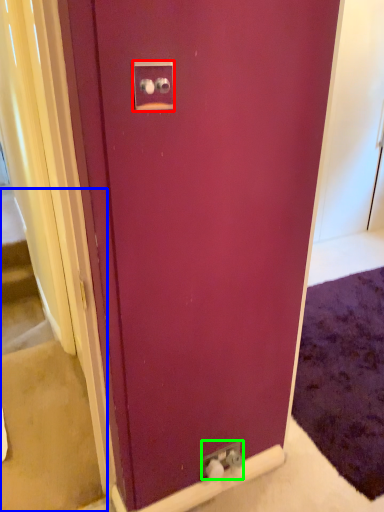
Question: Which object is the closest to the electric outlet (highlighted by a red box)? Choose among these: stairwell (highlighted by a blue box) or electric outlet (highlighted by a green box).

Choices:
 (A) stairwell
 (B) electric outlet

Answer: (B)